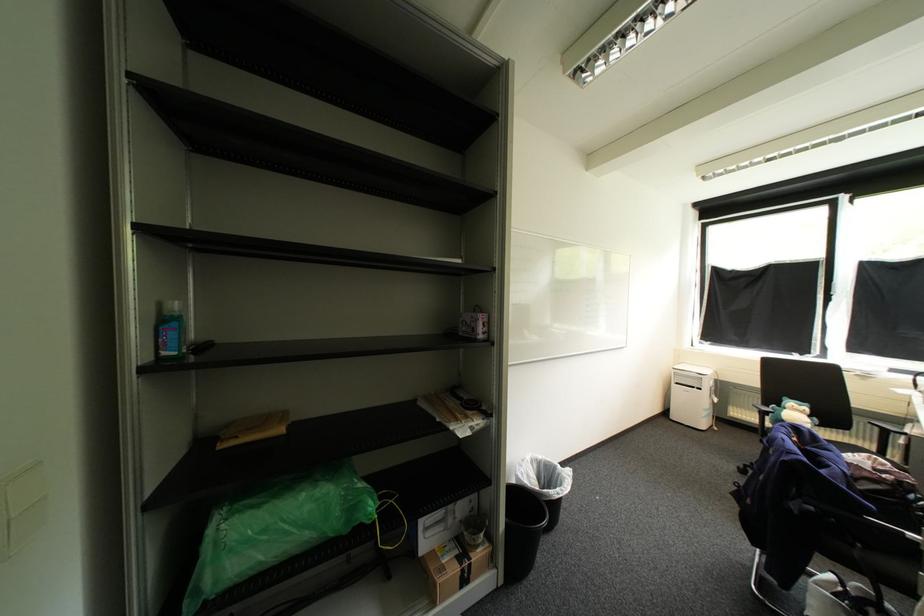
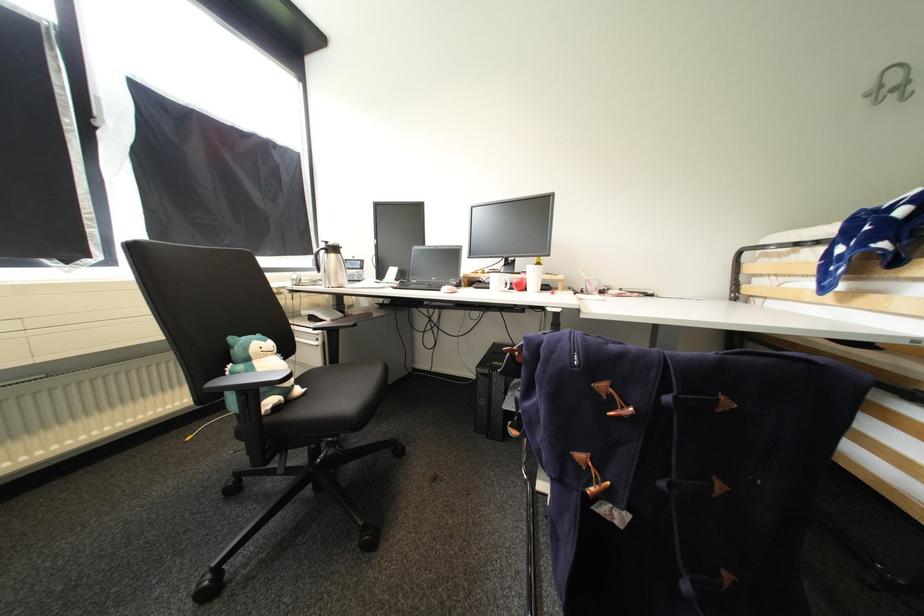
Question: I am providing you with two images of the same scene from different viewpoints. After the viewpoint changes to image2, which objects are now occluded?

Choices:
 (A) chair armrest
 (B) toothbrush charger base
 (C) red apple
 (D) silver wall hook

Answer: (A)